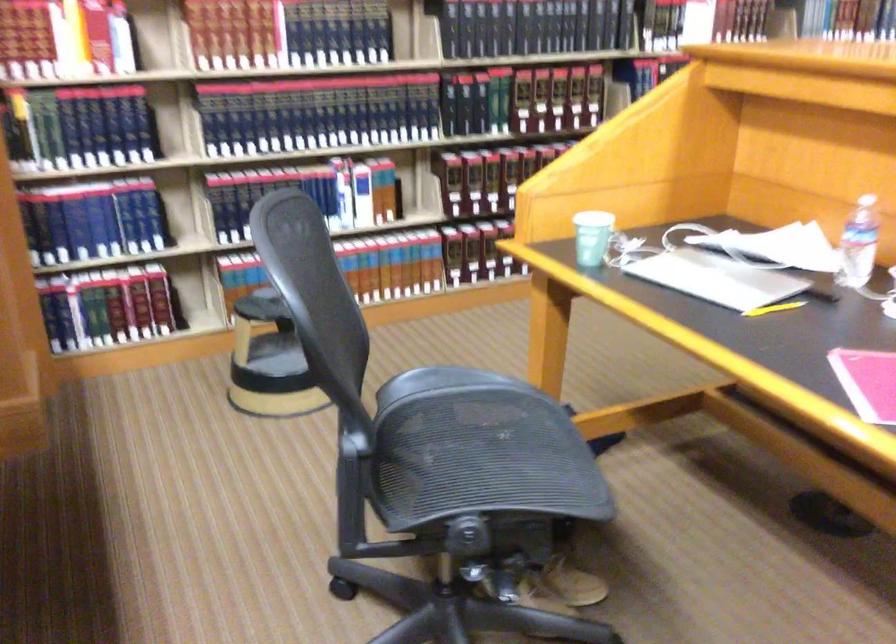
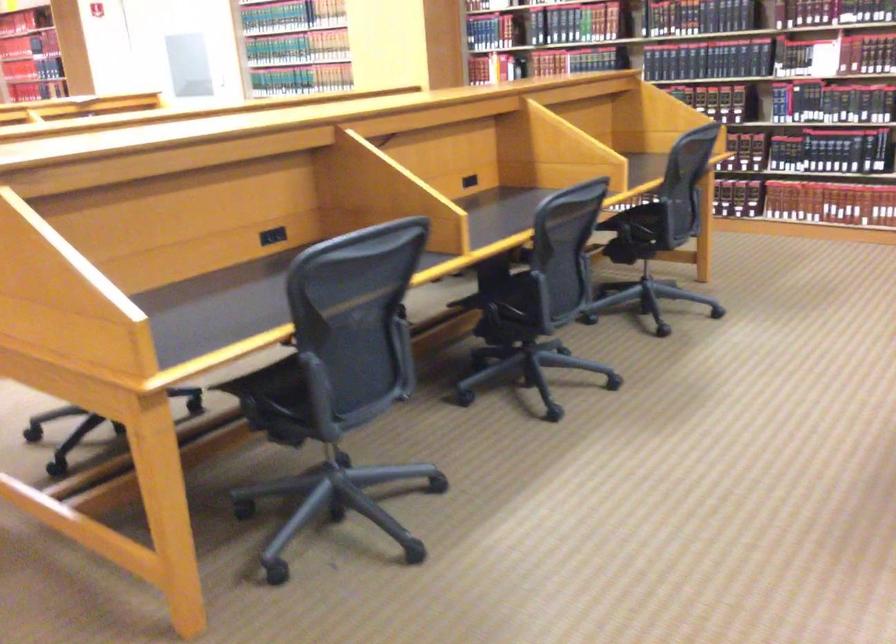
Question: I am providing you with two images of the same scene from different viewpoints. Which of the following objects are not visible in image2?

Choices:
 (A) blue food can
 (B) black power outlet
 (C) yellow pencil
 (D) hardcover book

Answer: (C)